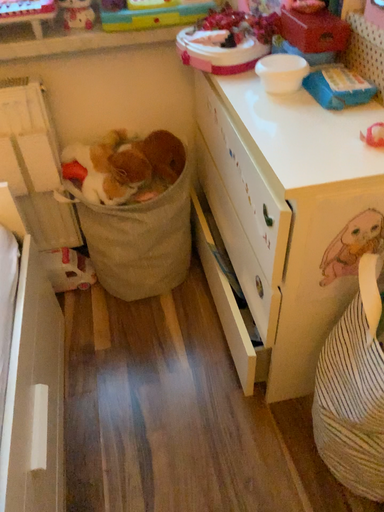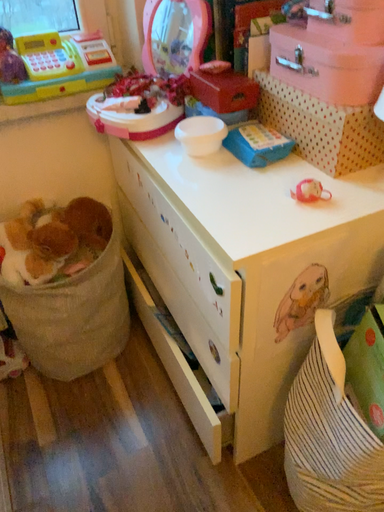
Question: How did the camera likely rotate when shooting the video?

Choices:
 (A) rotated left
 (B) rotated right

Answer: (B)